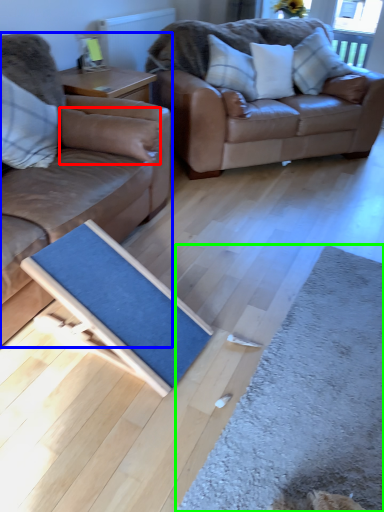
Question: Based on their relative distances, which object is nearer to pillow (highlighted by a red box)? Choose from studio couch (highlighted by a blue box) and doormat (highlighted by a green box).

Choices:
 (A) studio couch
 (B) doormat

Answer: (A)